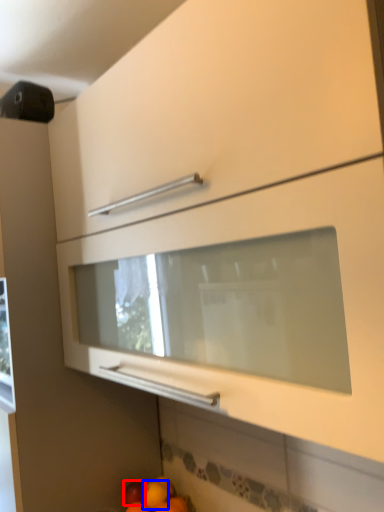
Question: Which of the following is the closest to the observer, apple (highlighted by a red box) or orange (highlighted by a blue box)?

Choices:
 (A) apple
 (B) orange

Answer: (B)